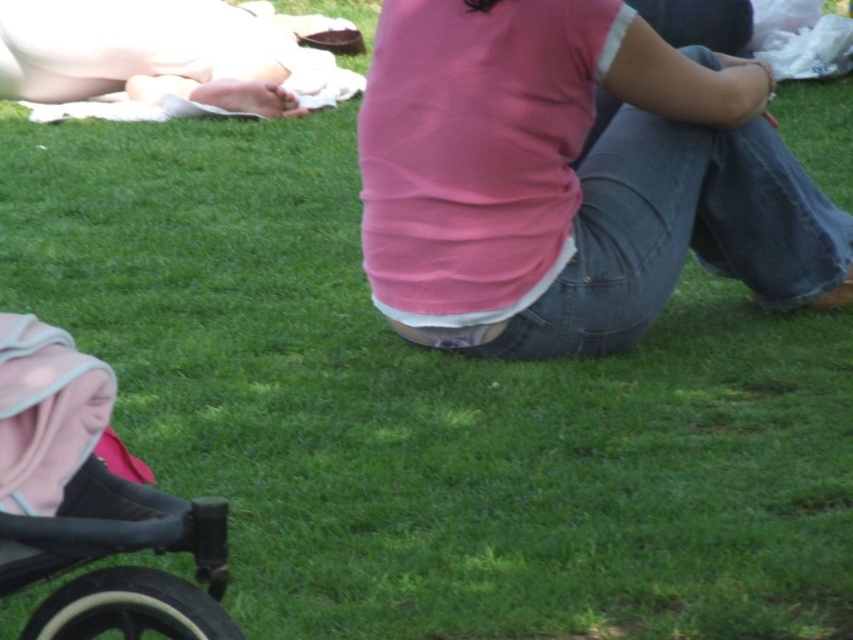
You are a photographer standing at the edge of the grassy area. You want to take a photo that includes both the pink cotton shirt at center and the matte pink shirt at upper center. Given that your camera has a maximum focus range of 3 meters, will you be able to capture both subjects clearly in focus?

The pink cotton shirt at center is 3.89 meters away from the matte pink shirt at upper center. Since the distance between them exceeds the camera maximum focus range of 3 meters, you will not be able to capture both subjects clearly in focus.

You are a photographer trying to capture a photo of the black rubber baby carriage at lower left and the pink cotton shirt at center. Since you want to ensure both subjects are in focus, you need to know which object is larger. Which one is bigger?

The pink cotton shirt at center is bigger than the black rubber baby carriage at lower left, so you should focus on the pink cotton shirt at center first as it requires more attention due to its size.